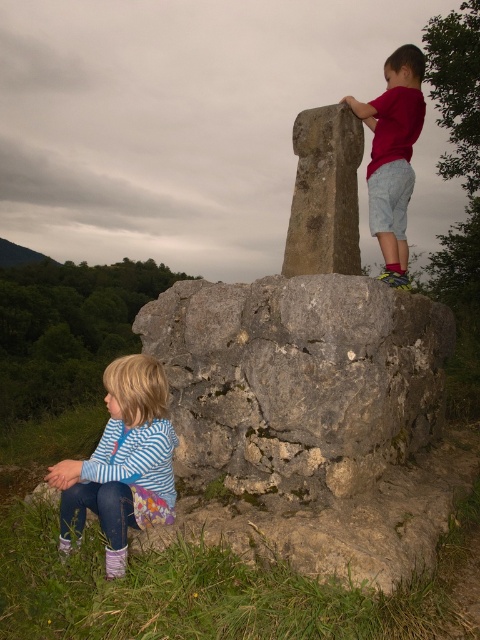
Is striped fabric shirt at lower left below red cotton shirt at upper right?

Yes.

Is striped fabric shirt at lower left positioned behind red cotton shirt at upper right?

No, striped fabric shirt at lower left is in front of red cotton shirt at upper right.

Is point (108, 536) closer to camera compared to point (368, 166)?

Yes, point (108, 536) is in front of point (368, 166).

The image size is (480, 640). In order to click on striped fabric shirt at lower left in this screenshot , I will do point(122,461).

Can you confirm if gray rough rock at center is positioned to the right of striped fabric shirt at lower left?

Correct, you'll find gray rough rock at center to the right of striped fabric shirt at lower left.

Is gray rough rock at center positioned at the back of striped fabric shirt at lower left?

Yes, gray rough rock at center is behind striped fabric shirt at lower left.

Where is `gray rough rock at center`? Image resolution: width=480 pixels, height=640 pixels. gray rough rock at center is located at coordinates (299, 380).

Between gray rough rock at center and red cotton shirt at upper right, which one appears on the right side from the viewer's perspective?

red cotton shirt at upper right is more to the right.

Is gray rough rock at center behind red cotton shirt at upper right?

That is False.

At what (x,y) coordinates should I click in order to perform the action: click on gray rough rock at center. Please return your answer as a coordinate pair (x, y). Looking at the image, I should click on point(299,380).